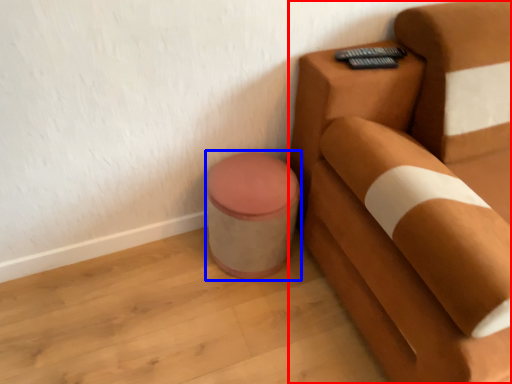
Question: Among these objects, which one is nearest to the camera, furniture (highlighted by a red box) or potty (highlighted by a blue box)?

Choices:
 (A) furniture
 (B) potty

Answer: (A)